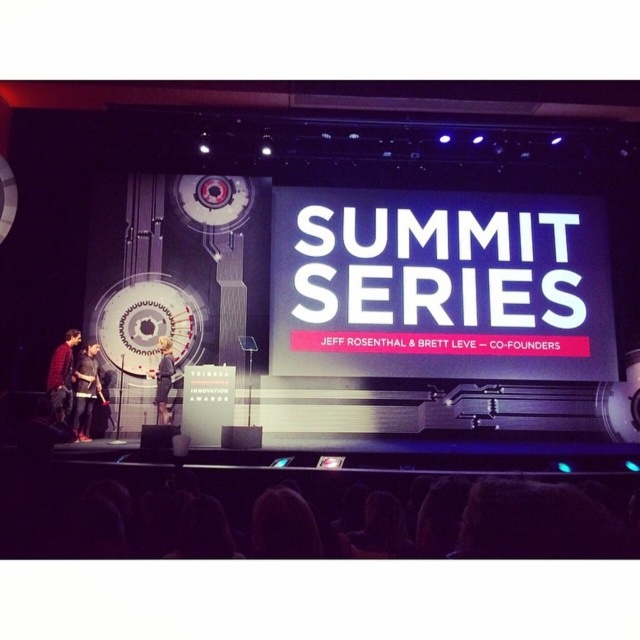
Question: From the image, what is the correct spatial relationship of dark gray fabric jacket at left in relation to light brown leather jacket at center?

Choices:
 (A) left
 (B) right

Answer: (A)

Question: Which object appears farthest from the camera in this image?

Choices:
 (A) dark gray fabric jacket at left
 (B) light brown leather jacket at center
 (C) matte black jacket at left

Answer: (B)

Question: Is dark gray fabric jacket at left above matte black jacket at left?

Choices:
 (A) yes
 (B) no

Answer: (B)

Question: Which of the following is the farthest from the observer?

Choices:
 (A) (90, 374)
 (B) (51, 390)

Answer: (A)

Question: Which point is farther from the camera taking this photo?

Choices:
 (A) (81, 435)
 (B) (161, 364)
 (C) (58, 404)

Answer: (B)

Question: Does matte black jacket at left appear on the right side of light brown leather jacket at center?

Choices:
 (A) no
 (B) yes

Answer: (A)